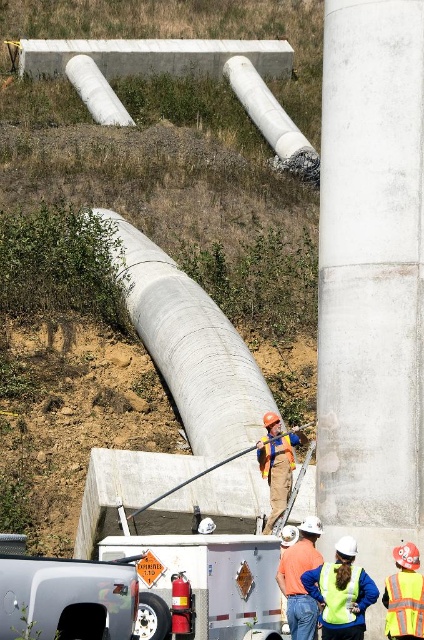
Between white concrete pillar at center and reflective fabric safety vest at center, which one has more height?

Standing taller between the two is white concrete pillar at center.

Is white concrete pillar at center smaller than reflective fabric safety vest at center?

No, white concrete pillar at center is not smaller than reflective fabric safety vest at center.

The image size is (424, 640). I want to click on white concrete pillar at center, so click(x=371, y=264).

Does point (373, 448) come closer to viewer compared to point (276, 426)?

Yes, point (373, 448) is in front of point (276, 426).

Which is in front, point (320, 204) or point (278, 440)?

Point (278, 440) is in front.

The image size is (424, 640). What are the coordinates of `white concrete pillar at center` in the screenshot? It's located at (371, 264).

Which of these two, white concrete pillar at center or orange safety vest at center, stands taller?

white concrete pillar at center

Between point (343, 444) and point (309, 557), which one is positioned in front?

Point (309, 557) is more forward.

Which is behind, point (337, 225) or point (309, 620)?

The point (337, 225) is more distant.

Find the location of `white concrete pillar at center`. white concrete pillar at center is located at coordinates (371, 264).